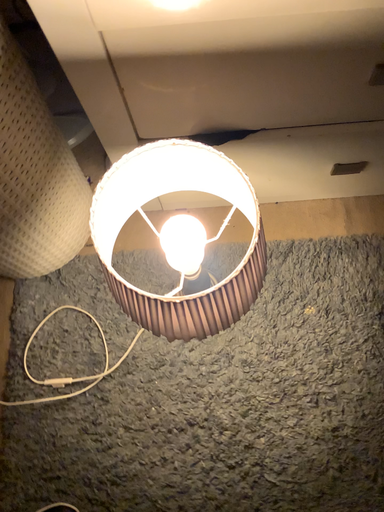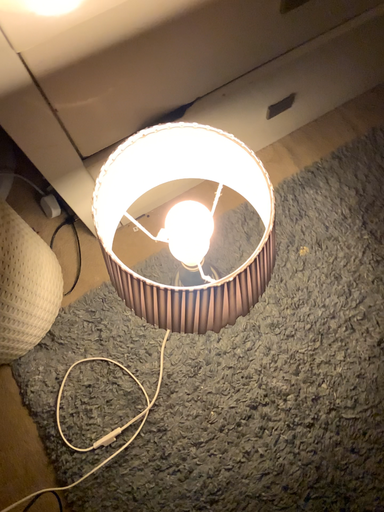
Question: Which way did the camera rotate in the video?

Choices:
 (A) rotated right
 (B) rotated left

Answer: (A)